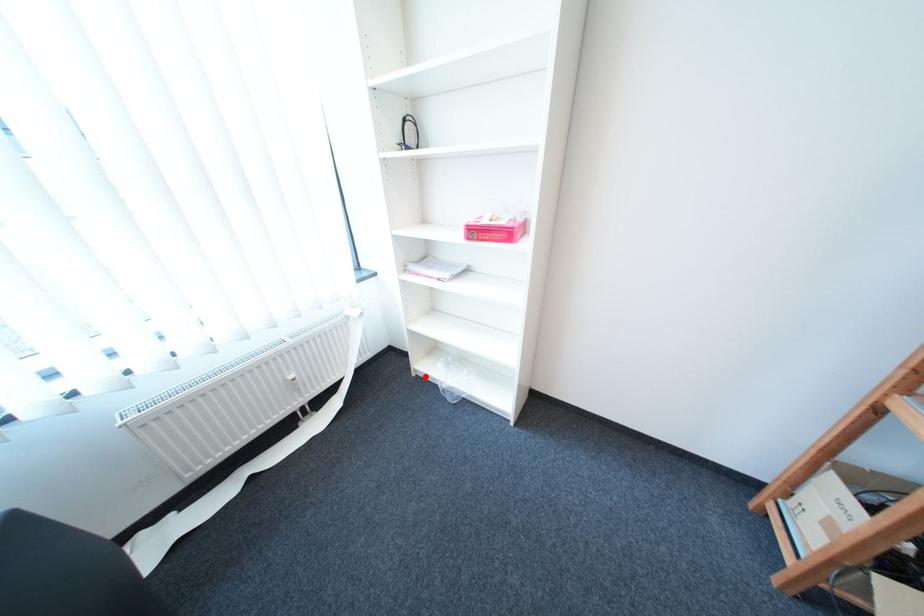
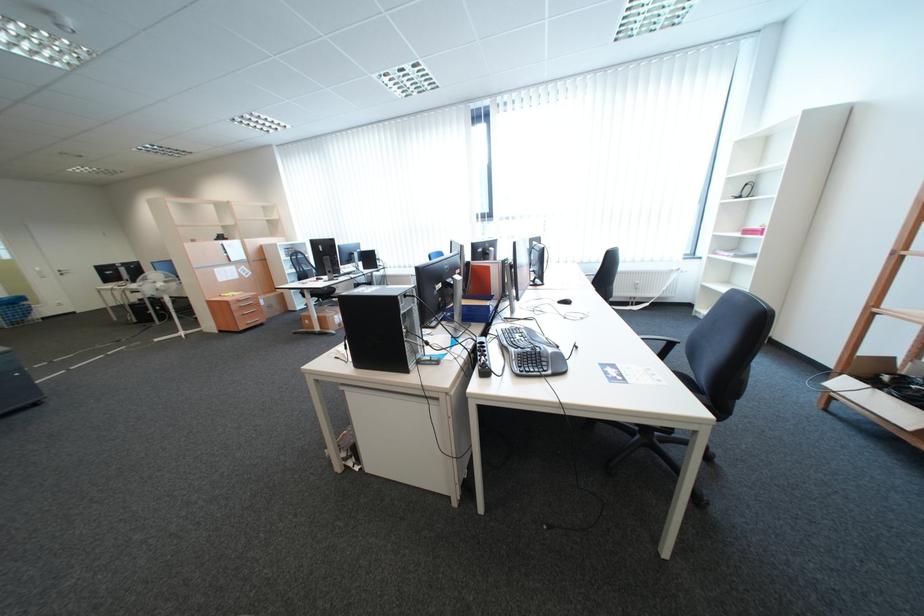
Locate, in the second image, the point that corresponds to the highlighted location in the first image.

(704, 315)